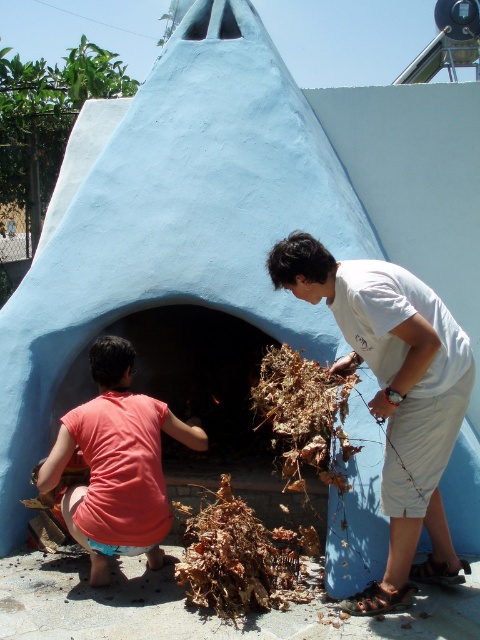
Can you confirm if white cotton shirt at center is wider than pink fabric shirt at lower left?

Yes, white cotton shirt at center is wider than pink fabric shirt at lower left.

Who is higher up, white cotton shirt at center or pink fabric shirt at lower left?

white cotton shirt at center is higher up.

Which is in front, point (432, 310) or point (107, 467)?

Point (432, 310) is more forward.

At what (x,y) coordinates should I click in order to perform the action: click on white cotton shirt at center. Please return your answer as a coordinate pair (x, y). The image size is (480, 640). Looking at the image, I should click on (395, 396).